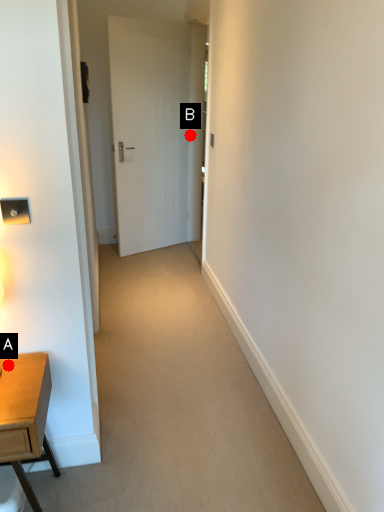
Question: Two points are circled on the image, labeled by A and B beside each circle. Which point is closer to the camera?

Choices:
 (A) A is closer
 (B) B is closer

Answer: (A)